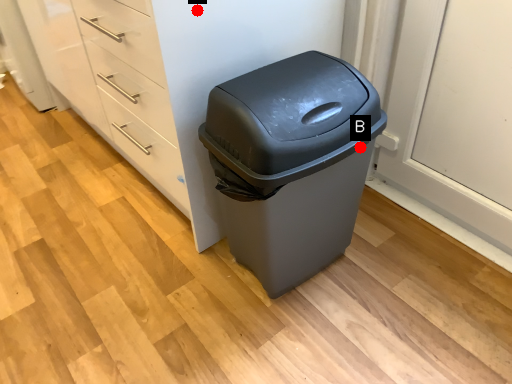
Question: Two points are circled on the image, labeled by A and B beside each circle. Which point is closer to the camera?

Choices:
 (A) A is closer
 (B) B is closer

Answer: (A)